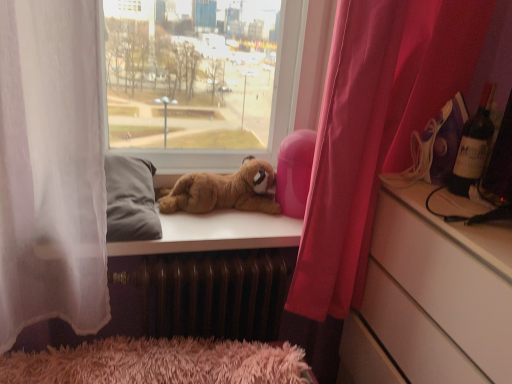
The height and width of the screenshot is (384, 512). What do you see at coordinates (213, 293) in the screenshot?
I see `brown metallic radiator at lower center` at bounding box center [213, 293].

In order to face brown metallic radiator at lower center, should I rotate leftwards or rightwards?

It's best to rotate left around 10.573 degrees.

This screenshot has width=512, height=384. What do you see at coordinates (439, 293) in the screenshot? I see `white glossy cabinet at right` at bounding box center [439, 293].

The image size is (512, 384). I want to click on dark red glass wine bottle at upper right, so click(473, 146).

Can you confirm if brown metallic radiator at lower center is shorter than soft brown plush dog at center?

Incorrect, the height of brown metallic radiator at lower center does not fall short of that of soft brown plush dog at center.

Is brown metallic radiator at lower center closer to camera compared to soft brown plush dog at center?

Yes, brown metallic radiator at lower center is closer to the viewer.

Which is correct: brown metallic radiator at lower center is inside soft brown plush dog at center, or outside of it?

brown metallic radiator at lower center cannot be found inside soft brown plush dog at center.

Consider the image. Is pink fabric curtain at right touching white glossy cabinet at right?

No, pink fabric curtain at right is not next to white glossy cabinet at right.

The width and height of the screenshot is (512, 384). In order to click on cabinetry below the pink fabric curtain at right (from the image's perspective) in this screenshot , I will do click(x=439, y=293).

Which is correct: pink fabric curtain at right is inside white glossy cabinet at right, or outside of it?

The correct answer is: outside.

The width and height of the screenshot is (512, 384). I want to click on cabinetry on the right side of dark red glass wine bottle at upper right, so click(x=439, y=293).

Can you tell me how much dark red glass wine bottle at upper right and white glossy cabinet at right differ in facing direction?

The angular difference between dark red glass wine bottle at upper right and white glossy cabinet at right is 0.465 degrees.

Based on the photo, from a real-world perspective, between dark red glass wine bottle at upper right and white glossy cabinet at right, who is vertically higher?

In real-world perspective, dark red glass wine bottle at upper right is above.

Which is in front, pink fabric curtain at right or brown metallic radiator at lower center?

Positioned in front is pink fabric curtain at right.

Considering the points (333, 230) and (142, 320), which point is behind, point (333, 230) or point (142, 320)?

The point (142, 320) is behind.

From the image's perspective, is pink fabric curtain at right over brown metallic radiator at lower center?

Yes, from the image's perspective, pink fabric curtain at right is above brown metallic radiator at lower center.

Considering the relative sizes of pink fabric curtain at right and brown metallic radiator at lower center in the image provided, is pink fabric curtain at right smaller than brown metallic radiator at lower center?

No, pink fabric curtain at right is not smaller than brown metallic radiator at lower center.

From a real-world perspective, does dark red glass wine bottle at upper right sit lower than brown metallic radiator at lower center?

Actually, dark red glass wine bottle at upper right is physically above brown metallic radiator at lower center in the real world.

Considering the relative sizes of dark red glass wine bottle at upper right and brown metallic radiator at lower center in the image provided, is dark red glass wine bottle at upper right wider than brown metallic radiator at lower center?

No.

Could brown metallic radiator at lower center be considered to be inside dark red glass wine bottle at upper right?

No, brown metallic radiator at lower center is not surrounded by dark red glass wine bottle at upper right.

Can you confirm if soft brown plush dog at center is positioned to the right of dark red glass wine bottle at upper right?

Incorrect, soft brown plush dog at center is not on the right side of dark red glass wine bottle at upper right.

Does soft brown plush dog at center have a smaller size compared to dark red glass wine bottle at upper right?

No, soft brown plush dog at center is not smaller than dark red glass wine bottle at upper right.

Is soft brown plush dog at center in front of or behind dark red glass wine bottle at upper right in the image?

soft brown plush dog at center is behind dark red glass wine bottle at upper right.

From a real-world perspective, between pink fabric curtain at right and dark red glass wine bottle at upper right, who is vertically lower?

From a 3D spatial view, pink fabric curtain at right is below.

Can you confirm if pink fabric curtain at right is bigger than dark red glass wine bottle at upper right?

Correct, pink fabric curtain at right is larger in size than dark red glass wine bottle at upper right.

Does point (434, 106) appear closer or farther from the camera than point (473, 174)?

Point (434, 106) appears to be farther away from the viewer than point (473, 174).

From the image's perspective, is pink fabric curtain at right beneath dark red glass wine bottle at upper right?

Correct, pink fabric curtain at right appears lower than dark red glass wine bottle at upper right in the image.

Find the location of a particular element. radiator that appears on the left of soft brown plush dog at center is located at coordinates (213, 293).

Where is `cabinetry lying in front of the pink fabric curtain at right`? cabinetry lying in front of the pink fabric curtain at right is located at coordinates (439, 293).

When comparing their distances from pink fabric curtain at right, does white glossy cabinet at right or brown metallic radiator at lower center seem further?

brown metallic radiator at lower center is further to pink fabric curtain at right.

When comparing their distances from pink fabric curtain at right, does white glossy cabinet at right or dark red glass wine bottle at upper right seem closer?

white glossy cabinet at right is closer to pink fabric curtain at right.

Based on the photo, when comparing their distances from brown metallic radiator at lower center, does pink fabric curtain at right or white glossy cabinet at right seem further?

white glossy cabinet at right lies further to brown metallic radiator at lower center than the other object.

Which object lies further to the anchor point white glossy cabinet at right, soft brown plush dog at center or brown metallic radiator at lower center?

soft brown plush dog at center is further to white glossy cabinet at right.

In the scene shown: From the image, which object appears to be farther from dark red glass wine bottle at upper right, brown metallic radiator at lower center or soft brown plush dog at center?

Among the two, brown metallic radiator at lower center is located further to dark red glass wine bottle at upper right.

Based on their spatial positions, is white glossy cabinet at right or pink fabric curtain at right further from dark red glass wine bottle at upper right?

Among the two, white glossy cabinet at right is located further to dark red glass wine bottle at upper right.

Based on their spatial positions, is dark red glass wine bottle at upper right or soft brown plush dog at center further from pink fabric curtain at right?

soft brown plush dog at center lies further to pink fabric curtain at right than the other object.

Looking at the image, which one is located further to pink fabric curtain at right, dark red glass wine bottle at upper right or white glossy cabinet at right?

dark red glass wine bottle at upper right is further to pink fabric curtain at right.

You are a GUI agent. You are given a task and a screenshot of the screen. Output one action in this format:
    pyautogui.click(x=<x>, y=<y>)
    Task: Click on the dog situated between brown metallic radiator at lower center and white glossy cabinet at right from left to right
    Image resolution: width=512 pixels, height=384 pixels.
    Given the screenshot: What is the action you would take?
    pyautogui.click(x=221, y=191)

The height and width of the screenshot is (384, 512). I want to click on curtain situated between soft brown plush dog at center and white glossy cabinet at right from left to right, so click(375, 129).

At what (x,y) coordinates should I click in order to perform the action: click on curtain located between brown metallic radiator at lower center and dark red glass wine bottle at upper right in the left-right direction. Please return your answer as a coordinate pair (x, y). The height and width of the screenshot is (384, 512). Looking at the image, I should click on (375, 129).

Where is `curtain located between soft brown plush dog at center and dark red glass wine bottle at upper right in the left-right direction`? This screenshot has height=384, width=512. curtain located between soft brown plush dog at center and dark red glass wine bottle at upper right in the left-right direction is located at coordinates (375, 129).